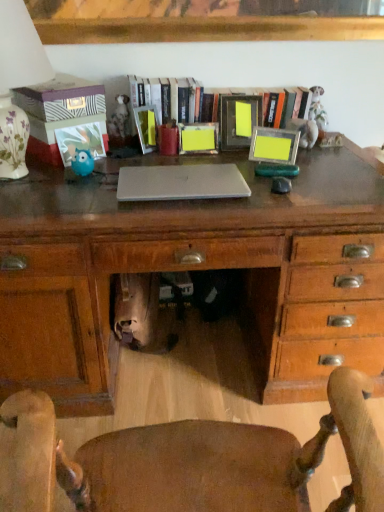
At what (x,y) coordinates should I click in order to perform the action: click on vacant area that is situated to the right of satin silver laptop at center. Please return your answer as a coordinate pair (x, y). Looking at the image, I should click on (285, 195).